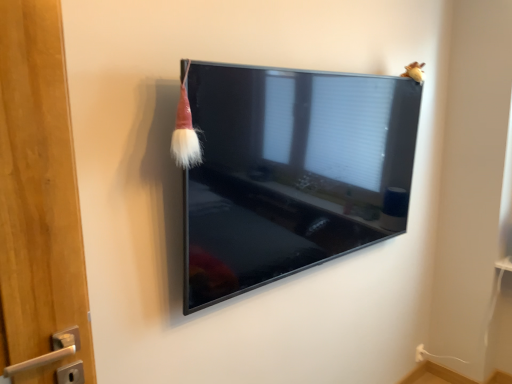
Question: Should I look upward or downward to see matte black tv at center?

Choices:
 (A) up
 (B) down

Answer: (A)

Question: Is red velvet brush at upper left not near matte black tv at center?

Choices:
 (A) no
 (B) yes

Answer: (A)

Question: Is red velvet brush at upper left positioned beyond the bounds of matte black tv at center?

Choices:
 (A) no
 (B) yes

Answer: (B)

Question: From the image's perspective, is red velvet brush at upper left on matte black tv at center?

Choices:
 (A) yes
 (B) no

Answer: (A)

Question: From the image's perspective, would you say red velvet brush at upper left is shown under matte black tv at center?

Choices:
 (A) yes
 (B) no

Answer: (B)

Question: Is the position of red velvet brush at upper left less distant than that of matte black tv at center?

Choices:
 (A) yes
 (B) no

Answer: (A)

Question: Is red velvet brush at upper left facing towards matte black tv at center?

Choices:
 (A) yes
 (B) no

Answer: (A)

Question: Can we say matte black tv at center lies outside red velvet brush at upper left?

Choices:
 (A) yes
 (B) no

Answer: (A)

Question: From a real-world perspective, is matte black tv at center on red velvet brush at upper left?

Choices:
 (A) yes
 (B) no

Answer: (B)

Question: From the image's perspective, would you say matte black tv at center is positioned over red velvet brush at upper left?

Choices:
 (A) yes
 (B) no

Answer: (B)

Question: Considering the relative sizes of matte black tv at center and red velvet brush at upper left in the image provided, is matte black tv at center thinner than red velvet brush at upper left?

Choices:
 (A) yes
 (B) no

Answer: (B)

Question: Could red velvet brush at upper left be considered to be inside matte black tv at center?

Choices:
 (A) yes
 (B) no

Answer: (B)

Question: Does matte black tv at center come in front of red velvet brush at upper left?

Choices:
 (A) yes
 (B) no

Answer: (B)

Question: Considering the relative sizes of matte black tv at center and fuzzy yellow toy at upper right in the image provided, is matte black tv at center wider than fuzzy yellow toy at upper right?

Choices:
 (A) yes
 (B) no

Answer: (A)